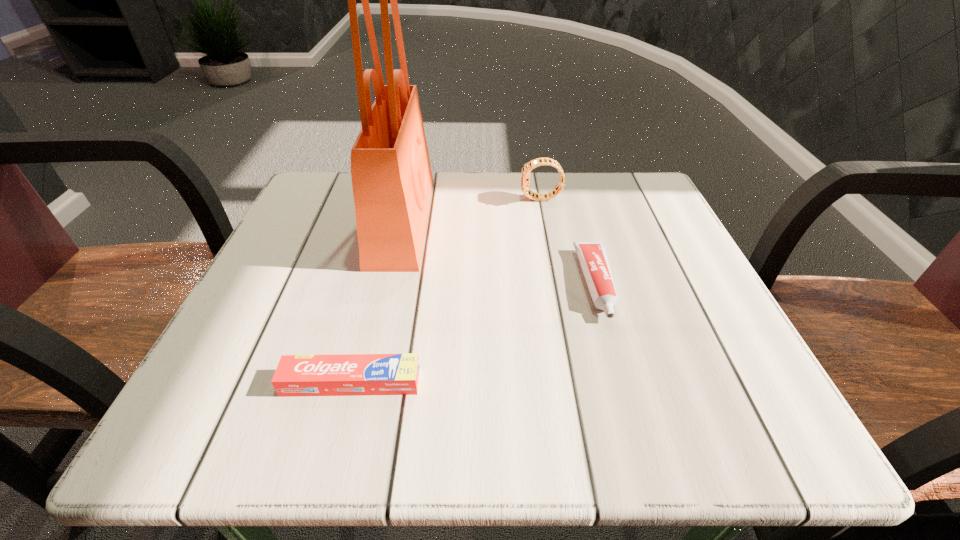
You are a GUI agent. You are given a task and a screenshot of the screen. Output one action in this format:
    pyautogui.click(x=<x>, y=<y>)
    Task: Click on the vacant area that lies between the nearer toothpaste and the right toothpaste
    The image size is (960, 540).
    Given the screenshot: What is the action you would take?
    pyautogui.click(x=474, y=333)

This screenshot has width=960, height=540. I want to click on vacant space in between the tote bag and the farther toothpaste, so click(x=499, y=252).

The image size is (960, 540). Find the location of `vacant space in between the nearest object and the farther toothpaste`. vacant space in between the nearest object and the farther toothpaste is located at coordinates (474, 333).

Locate an element on the screen. This screenshot has width=960, height=540. unoccupied area between the right toothpaste and the watch is located at coordinates (569, 241).

Locate an element on the screen. This screenshot has height=540, width=960. object that can be found as the second closest to the nearest object is located at coordinates (592, 255).

Find the location of a particular element. The width and height of the screenshot is (960, 540). the second closest object relative to the right toothpaste is located at coordinates (345, 374).

Image resolution: width=960 pixels, height=540 pixels. I want to click on free space that satisfies the following two spatial constraints: 1. on the face of the watch; 2. on the front side of the left toothpaste, so click(577, 382).